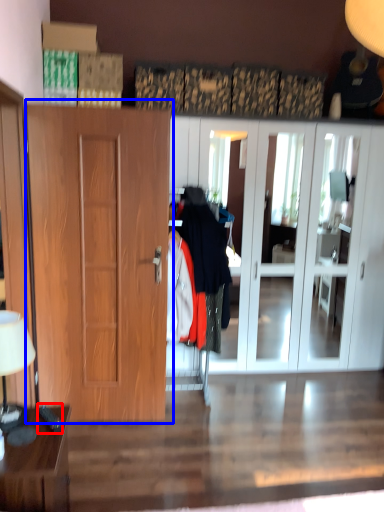
Question: Which object appears closest to the camera in this image, remote control (highlighted by a red box) or door (highlighted by a blue box)?

Choices:
 (A) remote control
 (B) door

Answer: (A)